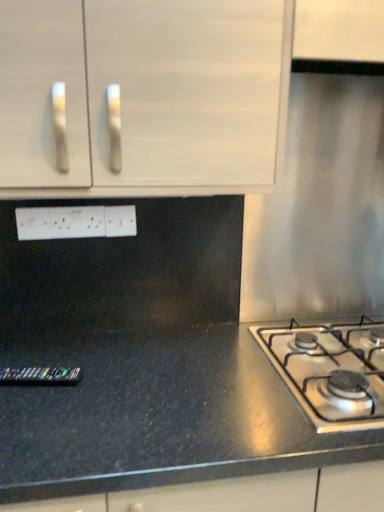
Locate an element on the screen. The width and height of the screenshot is (384, 512). white matte cabinet at upper left is located at coordinates (145, 95).

Measure the distance between black granite countertop at lower left and camera.

They are 28.03 inches apart.

Find the location of a particular element. satin silver gas stove at lower right is located at coordinates (331, 371).

From the image's perspective, is white matte cabinet at upper left above or below black granite countertop at lower left?

From the image's perspective, white matte cabinet at upper left appears above black granite countertop at lower left.

Can you confirm if white matte cabinet at upper left is thinner than black granite countertop at lower left?

Yes.

Could black granite countertop at lower left be considered to be inside white matte cabinet at upper left?

Actually, black granite countertop at lower left is outside white matte cabinet at upper left.

How far apart are white matte cabinet at upper left and black granite countertop at lower left?

A distance of 57.68 centimeters exists between white matte cabinet at upper left and black granite countertop at lower left.

Is satin silver gas stove at lower right at the back of white plastic electric outlet at center, the first electric outlet in the right-to-left sequence?

No, satin silver gas stove at lower right is not at the back of white plastic electric outlet at center, the first electric outlet in the right-to-left sequence.

Between white plastic electric outlet at center, which is the 2th electric outlet from left to right, and satin silver gas stove at lower right, which one has smaller width?

white plastic electric outlet at center, which is the 2th electric outlet from left to right.

How many degrees apart are the facing directions of white plastic electric outlet at center, which is the 2th electric outlet from left to right, and satin silver gas stove at lower right?

The angular difference between white plastic electric outlet at center, which is the 2th electric outlet from left to right, and satin silver gas stove at lower right is 0.981 degrees.

Does white plastic electric outlet at center, the first electric outlet in the right-to-left sequence, touch satin silver gas stove at lower right?

No, white plastic electric outlet at center, the first electric outlet in the right-to-left sequence, is not in contact with satin silver gas stove at lower right.

From the image's perspective, between white plastic electrical outlet at center, which is the 2th electric outlet from right to left, and satin silver gas stove at lower right, which one is located above?

white plastic electrical outlet at center, which is the 2th electric outlet from right to left.

Considering the sizes of objects white plastic electrical outlet at center, which is the 2th electric outlet from right to left, and satin silver gas stove at lower right in the image provided, who is taller, white plastic electrical outlet at center, which is the 2th electric outlet from right to left, or satin silver gas stove at lower right?

white plastic electrical outlet at center, which is the 2th electric outlet from right to left.

Is white plastic electrical outlet at center, marked as the first electric outlet in a left-to-right arrangement, not within satin silver gas stove at lower right?

white plastic electrical outlet at center, marked as the first electric outlet in a left-to-right arrangement, is positioned outside satin silver gas stove at lower right.

Can you confirm if white plastic electrical outlet at center, marked as the first electric outlet in a left-to-right arrangement, is positioned to the right of satin silver gas stove at lower right?

Incorrect, white plastic electrical outlet at center, marked as the first electric outlet in a left-to-right arrangement, is not on the right side of satin silver gas stove at lower right.

Based on the photo, which is less distant, (148, 428) or (281, 366)?

The point (148, 428) is closer.

Can you confirm if black granite countertop at lower left is positioned to the right of satin silver gas stove at lower right?

In fact, black granite countertop at lower left is to the left of satin silver gas stove at lower right.

Is black granite countertop at lower left spatially inside satin silver gas stove at lower right, or outside of it?

black granite countertop at lower left is located beyond the bounds of satin silver gas stove at lower right.

Is black granite countertop at lower left aimed at satin silver gas stove at lower right?

No, black granite countertop at lower left is not turned towards satin silver gas stove at lower right.

How distant is satin silver gas stove at lower right from white plastic electrical outlet at center, marked as the first electric outlet in a left-to-right arrangement?

satin silver gas stove at lower right is 27.89 inches away from white plastic electrical outlet at center, marked as the first electric outlet in a left-to-right arrangement.

Does point (331, 419) lie behind point (91, 224)?

No.

Which object is further away from the camera taking this photo, satin silver gas stove at lower right or white plastic electrical outlet at center, which is the 2th electric outlet from right to left?

white plastic electrical outlet at center, which is the 2th electric outlet from right to left, is further from the camera.

From the image's perspective, who appears lower, satin silver gas stove at lower right or white plastic electrical outlet at center, which is the 2th electric outlet from right to left?

satin silver gas stove at lower right is shown below in the image.

From the image's perspective, is satin silver gas stove at lower right positioned above or below white plastic electric outlet at center, which is the 2th electric outlet from left to right?

From the image's perspective, satin silver gas stove at lower right appears below white plastic electric outlet at center, which is the 2th electric outlet from left to right.

Is satin silver gas stove at lower right taller than white plastic electric outlet at center, which is the 2th electric outlet from left to right?

No.

Does satin silver gas stove at lower right turn towards white plastic electric outlet at center, the first electric outlet in the right-to-left sequence?

No, satin silver gas stove at lower right is not turned towards white plastic electric outlet at center, the first electric outlet in the right-to-left sequence.

Is satin silver gas stove at lower right placed right next to white plastic electric outlet at center, which is the 2th electric outlet from left to right?

No, satin silver gas stove at lower right is not beside white plastic electric outlet at center, which is the 2th electric outlet from left to right.

From the image's perspective, which one is positioned lower, white matte cabinet at upper left or satin silver gas stove at lower right?

satin silver gas stove at lower right appears lower in the image.

Image resolution: width=384 pixels, height=512 pixels. Identify the location of gas stove that appears below the white matte cabinet at upper left (from a real-world perspective). (331, 371).

How far apart are white matte cabinet at upper left and satin silver gas stove at lower right?

white matte cabinet at upper left is 25.40 inches from satin silver gas stove at lower right.

I want to click on countertop beneath the white matte cabinet at upper left (from a real-world perspective), so coord(158,417).

There is a satin silver gas stove at lower right. Identify the location of the 1st electric outlet above it (from a real-world perspective). The height and width of the screenshot is (512, 384). (120, 221).

Consider the image. Based on their spatial positions, is white plastic electrical outlet at center, which is the 2th electric outlet from right to left, or white plastic electric outlet at center, which is the 2th electric outlet from left to right, closer to white matte cabinet at upper left?

Among the two, white plastic electric outlet at center, which is the 2th electric outlet from left to right, is located nearer to white matte cabinet at upper left.

Which object lies further to the anchor point white matte cabinet at upper left, white plastic electrical outlet at center, which is the 2th electric outlet from right to left, or black granite countertop at lower left?

black granite countertop at lower left is positioned further to the anchor white matte cabinet at upper left.

Based on their spatial positions, is white plastic electric outlet at center, which is the 2th electric outlet from left to right, or black granite countertop at lower left closer to satin silver gas stove at lower right?

black granite countertop at lower left lies closer to satin silver gas stove at lower right than the other object.

When comparing their distances from white plastic electric outlet at center, which is the 2th electric outlet from left to right, does white matte cabinet at upper left or satin silver gas stove at lower right seem closer?

white matte cabinet at upper left is positioned closer to the anchor white plastic electric outlet at center, which is the 2th electric outlet from left to right.

Estimate the real-world distances between objects in this image. Which object is further from white plastic electrical outlet at center, which is the 2th electric outlet from right to left, satin silver gas stove at lower right or white plastic electric outlet at center, which is the 2th electric outlet from left to right?

satin silver gas stove at lower right lies further to white plastic electrical outlet at center, which is the 2th electric outlet from right to left, than the other object.

From the image, which object appears to be nearer to satin silver gas stove at lower right, white plastic electrical outlet at center, marked as the first electric outlet in a left-to-right arrangement, or black granite countertop at lower left?

black granite countertop at lower left is closer to satin silver gas stove at lower right.

From the image, which object appears to be nearer to white matte cabinet at upper left, black granite countertop at lower left or white plastic electrical outlet at center, marked as the first electric outlet in a left-to-right arrangement?

white plastic electrical outlet at center, marked as the first electric outlet in a left-to-right arrangement, is closer to white matte cabinet at upper left.

Considering their positions, is white matte cabinet at upper left positioned further to white plastic electrical outlet at center, which is the 2th electric outlet from right to left, than white plastic electric outlet at center, the first electric outlet in the right-to-left sequence?

The object further to white plastic electrical outlet at center, which is the 2th electric outlet from right to left, is white matte cabinet at upper left.

Locate an element on the screen. cabinetry between white plastic electrical outlet at center, marked as the first electric outlet in a left-to-right arrangement, and satin silver gas stove at lower right is located at coordinates (145, 95).

Locate an element on the screen. electric outlet between white plastic electrical outlet at center, marked as the first electric outlet in a left-to-right arrangement, and satin silver gas stove at lower right, in the horizontal direction is located at coordinates (120, 221).

Identify the location of cabinetry situated between white plastic electric outlet at center, which is the 2th electric outlet from left to right, and satin silver gas stove at lower right from left to right. Image resolution: width=384 pixels, height=512 pixels. pyautogui.click(x=145, y=95).

Locate an element on the screen. This screenshot has height=512, width=384. countertop between white plastic electrical outlet at center, which is the 2th electric outlet from right to left, and satin silver gas stove at lower right from left to right is located at coordinates (158, 417).